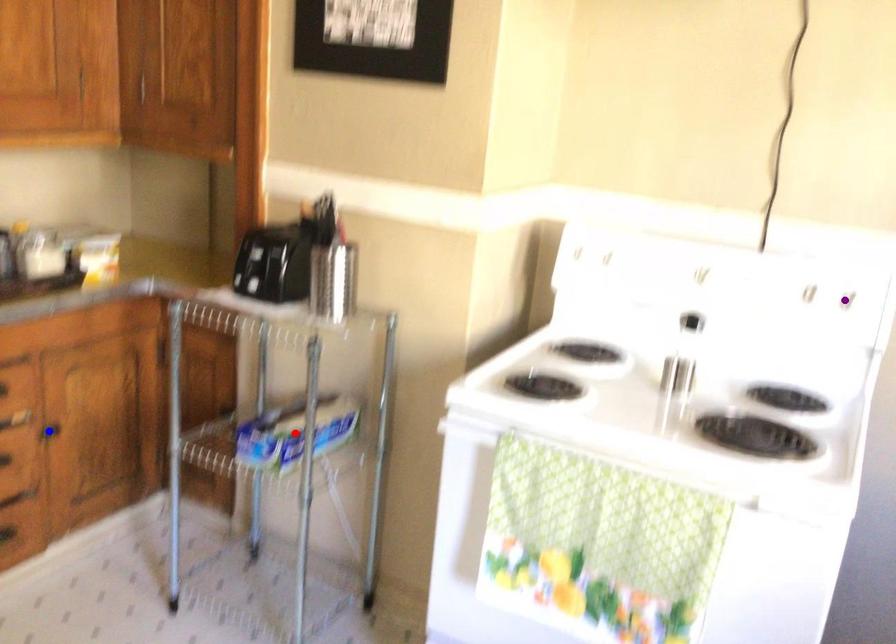
Based on the photo, order these from farthest to nearest:
purple point, red point, blue point

blue point < red point < purple point